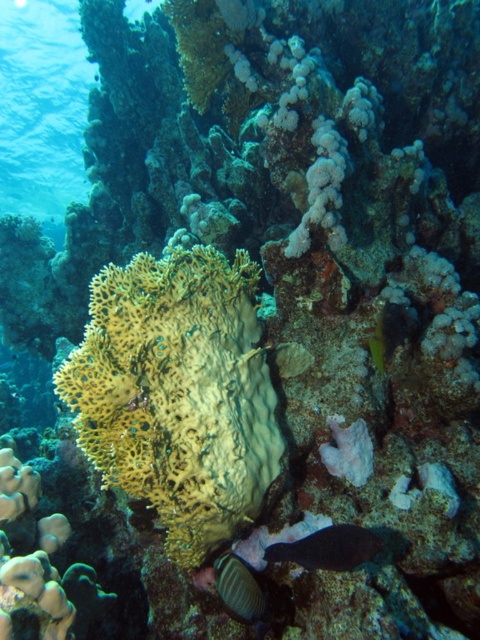
Does yellow sponge at center have a lesser height compared to shiny brown fish at lower center?

In fact, yellow sponge at center may be taller than shiny brown fish at lower center.

Who is positioned more to the right, yellow sponge at center or shiny brown fish at lower center?

shiny brown fish at lower center

Is point (135, 340) positioned before point (235, 577)?

That is True.

Find the location of a particular element. yellow sponge at center is located at coordinates [178, 394].

Does smooth dark blue fish at lower center have a greater width compared to shiny brown fish at lower center?

Yes, smooth dark blue fish at lower center is wider than shiny brown fish at lower center.

Image resolution: width=480 pixels, height=640 pixels. What do you see at coordinates (328, 548) in the screenshot? I see `smooth dark blue fish at lower center` at bounding box center [328, 548].

I want to click on smooth dark blue fish at lower center, so click(328, 548).

Which is more to the right, yellow sponge at center or smooth dark blue fish at lower center?

From the viewer's perspective, smooth dark blue fish at lower center appears more on the right side.

Is yellow sponge at center further to camera compared to smooth dark blue fish at lower center?

Yes, it is behind smooth dark blue fish at lower center.

Who is more forward, (216, 461) or (337, 525)?

Point (337, 525) is more forward.

In order to click on yellow sponge at center in this screenshot , I will do `click(178, 394)`.